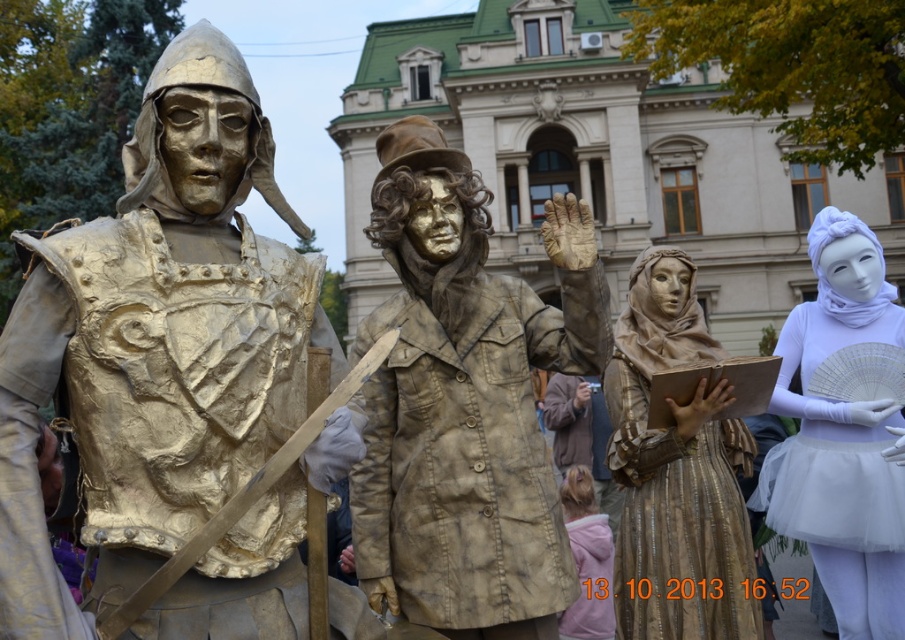
You are a street performer who wants to choose a costume for a performance. You have two options in front of you, the gold textured coat at center and the gold textured fabric dress at center. Which costume would you pick if you want to appear more imposing?

The gold textured coat at center is larger in size than the gold textured fabric dress at center, so you should choose the gold textured coat at center to appear more imposing.

You are a photographer planning to take a photo of the gold textured fabric dress at center and the white tulle skirt at right. To ensure both are in frame, should you position your camera to the left or right of the statues?

You should position your camera to the right of the statues because the gold textured fabric dress at center is to the left of white tulle skirt at right, so placing the camera to the right will allow both to be captured in the frame.